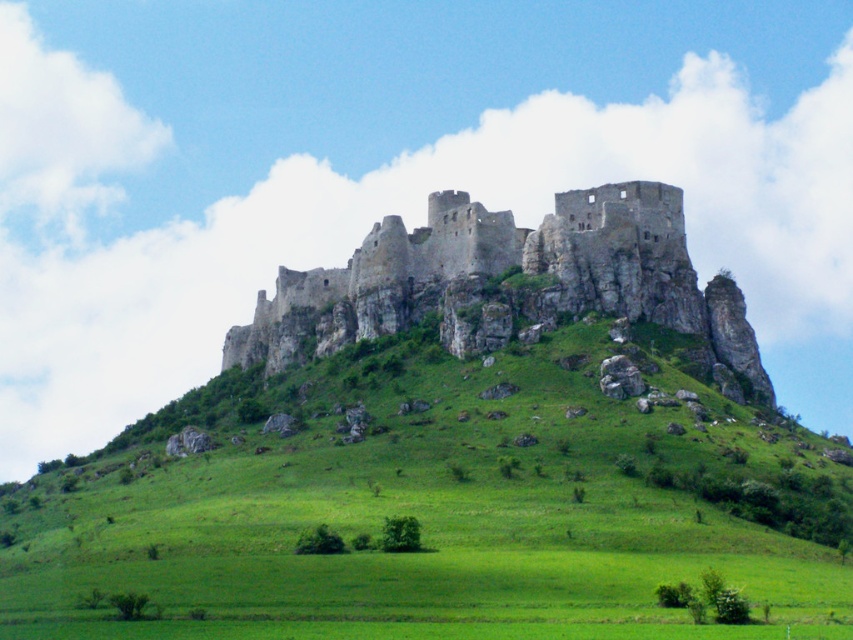
Who is positioned more to the right, green grassy hill at center or rustic stone castle at center?

Positioned to the right is rustic stone castle at center.

Is point (51, 589) farther from camera compared to point (427, 257)?

No, (51, 589) is closer to viewer.

Which is behind, point (318, 456) or point (590, 308)?

The point (590, 308) is more distant.

I want to click on green grassy hill at center, so [439, 506].